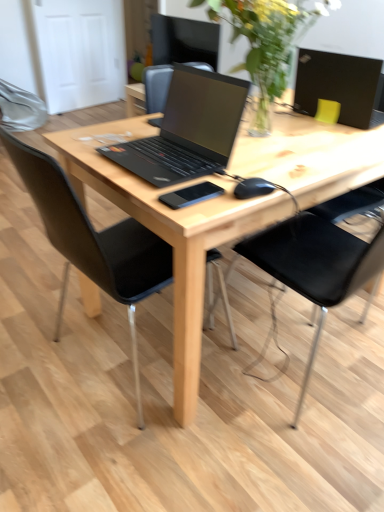
Where is `free space behind black matte mouse at center`? The height and width of the screenshot is (512, 384). free space behind black matte mouse at center is located at coordinates 267,165.